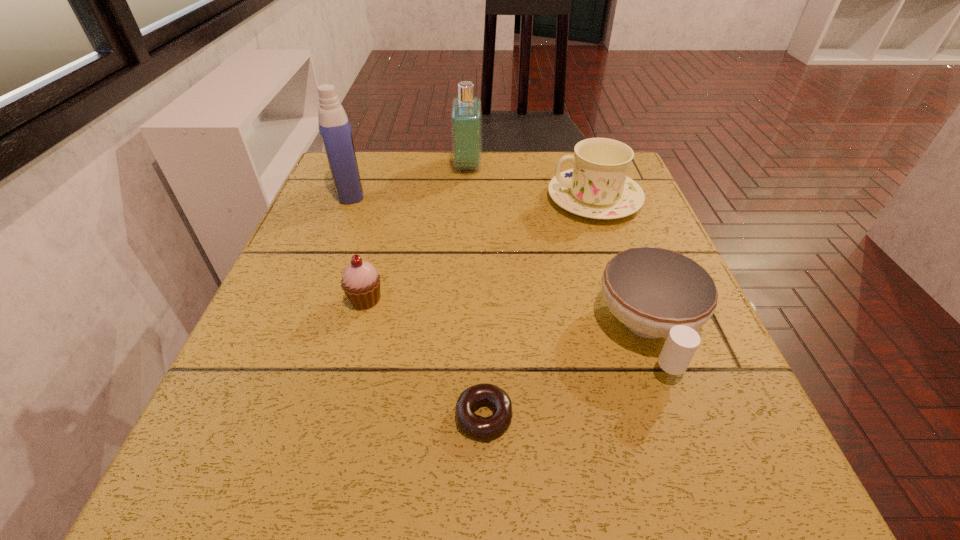
Locate an element on the screen. The image size is (960, 540). free spot located 0.130m on the front label of the fifth shortest object is located at coordinates [532, 166].

This screenshot has width=960, height=540. In order to click on vacant space located 0.300m on the handle side of the fourth shortest object in this screenshot , I will do `click(419, 199)`.

The height and width of the screenshot is (540, 960). Find the location of `free location located 0.310m on the handle side of the fourth shortest object`. free location located 0.310m on the handle side of the fourth shortest object is located at coordinates (415, 199).

Locate an element on the screen. The image size is (960, 540). free location located on the handle side of the fourth shortest object is located at coordinates (526, 199).

Locate an element on the screen. The height and width of the screenshot is (540, 960). free space located on the left of the cupcake is located at coordinates (313, 300).

In order to click on free space located on the side with the handle of the nearer chinaware in this screenshot , I will do `click(708, 491)`.

Identify the location of vacant space located 0.200m on the right of the nearest object. The height and width of the screenshot is (540, 960). (654, 416).

You are a GUI agent. You are given a task and a screenshot of the screen. Output one action in this format:
    pyautogui.click(x=<x>, y=<y>)
    Task: Click on the detergent located at the far edge
    
    Given the screenshot: What is the action you would take?
    pyautogui.click(x=334, y=126)

Where is `perfume present at the far edge`? This screenshot has height=540, width=960. perfume present at the far edge is located at coordinates click(x=466, y=113).

Where is `chinaware positioned at the far edge`? The image size is (960, 540). chinaware positioned at the far edge is located at coordinates (597, 187).